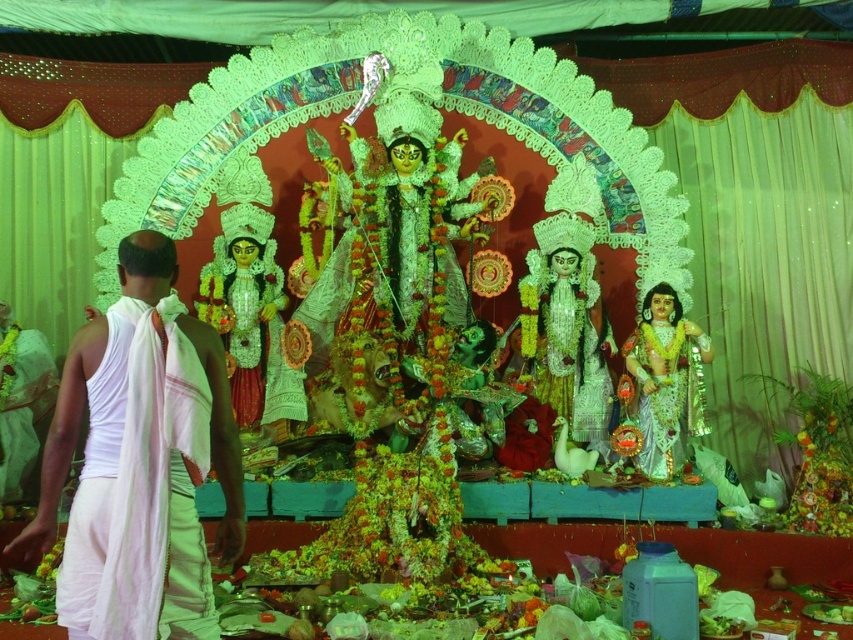
You are a photographer positioned at the back of the scene. You want to take a photo of the shiny silver statue at center without the white clothed person at left blocking it. Is this possible?

The white clothed person at left is in front of the shiny silver statue at center, so you cannot take a photo of the shiny silver statue at center without the white clothed person at left blocking it unless you move the person or statue.

You are standing in front of the altar and notice two points marked in the scene. The first point is at coordinate point (86, 561) and the second is at point (645, 385). Which of these points is closer to you?

Point (86, 561) is in front of point (645, 385), so it is closer to you.